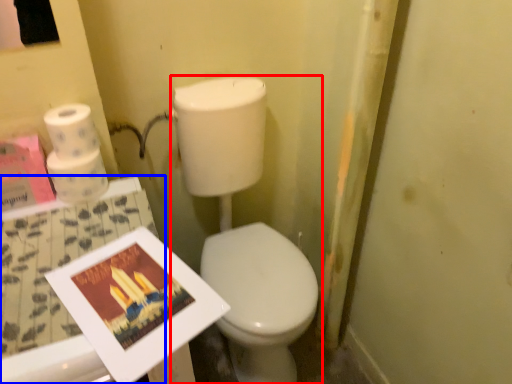
Question: Which object appears closest to the camera in this image, toiletries (highlighted by a red box) or table (highlighted by a blue box)?

Choices:
 (A) toiletries
 (B) table

Answer: (B)